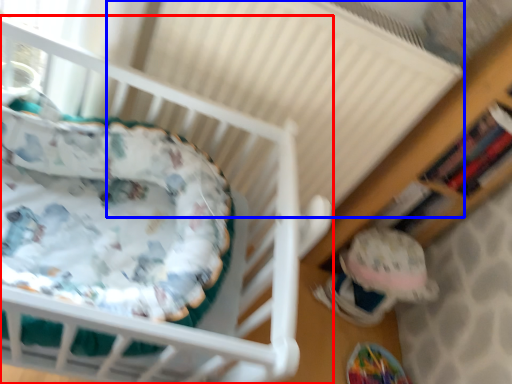
Question: Which object appears farthest to the camera in this image, infant bed (highlighted by a red box) or radiator (highlighted by a blue box)?

Choices:
 (A) infant bed
 (B) radiator

Answer: (B)